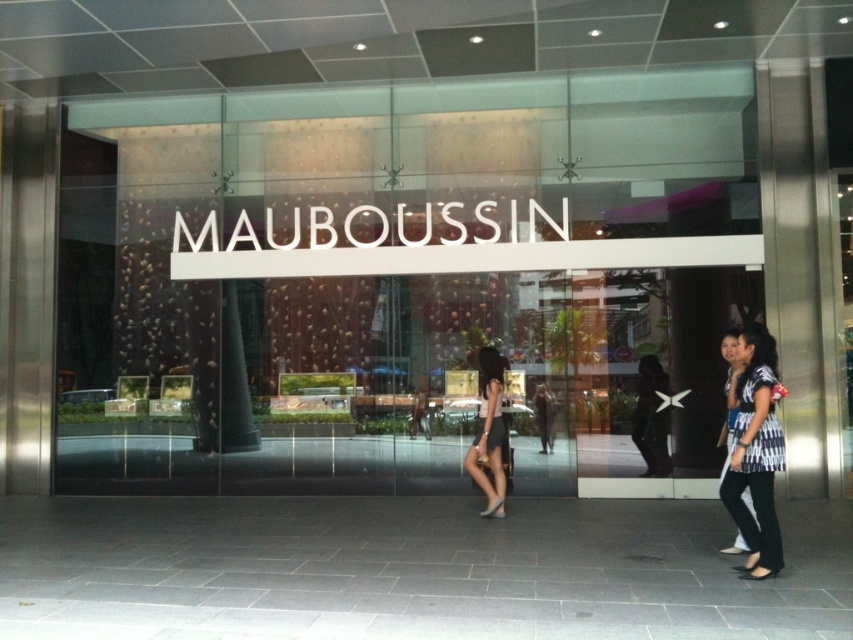
You are a customer entering MAUBOUSSIN and want to see both the striped fabric blouse at right and the matte white dress at center. Which item will you reach first as you walk towards them?

The striped fabric blouse at right will be reached first because it is closer to the viewer than the matte white dress at center.